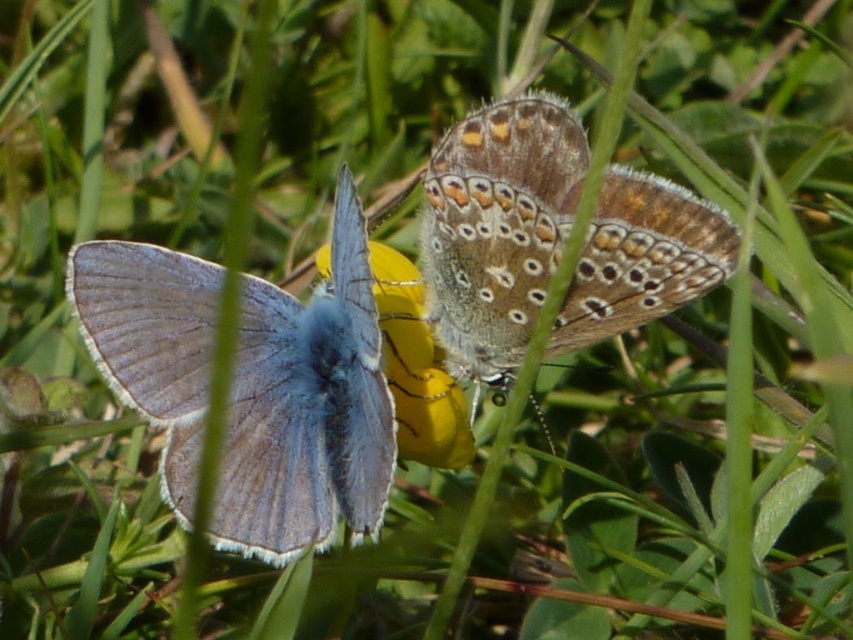
Question: Among these objects, which one is nearest to the camera?

Choices:
 (A) brown speckled wings at center
 (B) yellow matte flower at center
 (C) matte blue butterfly at left

Answer: (C)

Question: Is matte blue butterfly at left below yellow matte flower at center?

Choices:
 (A) yes
 (B) no

Answer: (A)

Question: Which point is farther to the camera?

Choices:
 (A) (474, 394)
 (B) (314, 440)
 (C) (399, 456)

Answer: (A)

Question: In this image, where is matte blue butterfly at left located relative to brown speckled wings at center?

Choices:
 (A) left
 (B) right

Answer: (A)

Question: Does brown speckled wings at center have a larger size compared to yellow matte flower at center?

Choices:
 (A) no
 (B) yes

Answer: (B)

Question: Estimate the real-world distances between objects in this image. Which object is closer to the yellow matte flower at center?

Choices:
 (A) matte blue butterfly at left
 (B) brown speckled wings at center

Answer: (A)